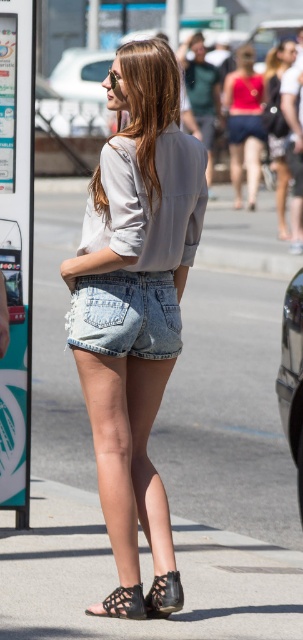
In the scene shown: You are a fashion designer analyzing the outfit of the woman in the image. Based on the spatial relationship between the denim shorts at center and the black woven sandal at lower center, which item is positioned higher on her body?

The denim shorts at center is much taller as black woven sandal at lower center, so the denim shorts at center is positioned higher on her body than the black woven sandal at lower center.

You are a fashion designer observing a woman on a sidewalk. You notice the matte gray shirt at upper center and the black woven sandal at lower center. How far apart are these two items on her body?

The matte gray shirt at upper center and the black woven sandal at lower center are 8.81 feet apart from each other.